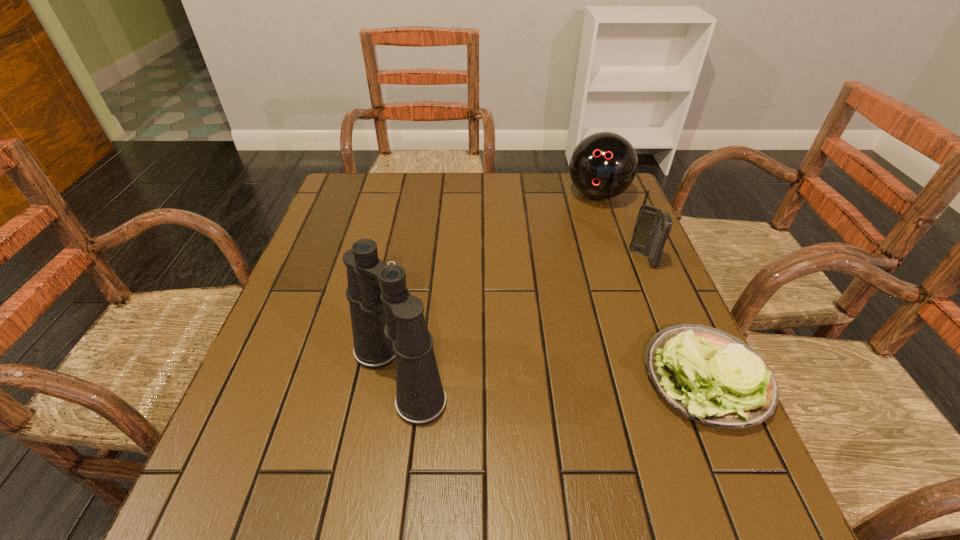
This screenshot has width=960, height=540. I want to click on vacant space that satisfies the following two spatial constraints: 1. on the front side of the leftmost object; 2. on the right side of the lettuce, so click(398, 378).

Image resolution: width=960 pixels, height=540 pixels. Identify the location of free space that satisfies the following two spatial constraints: 1. on the back side of the leftmost object; 2. on the right side of the farthest object. (427, 194).